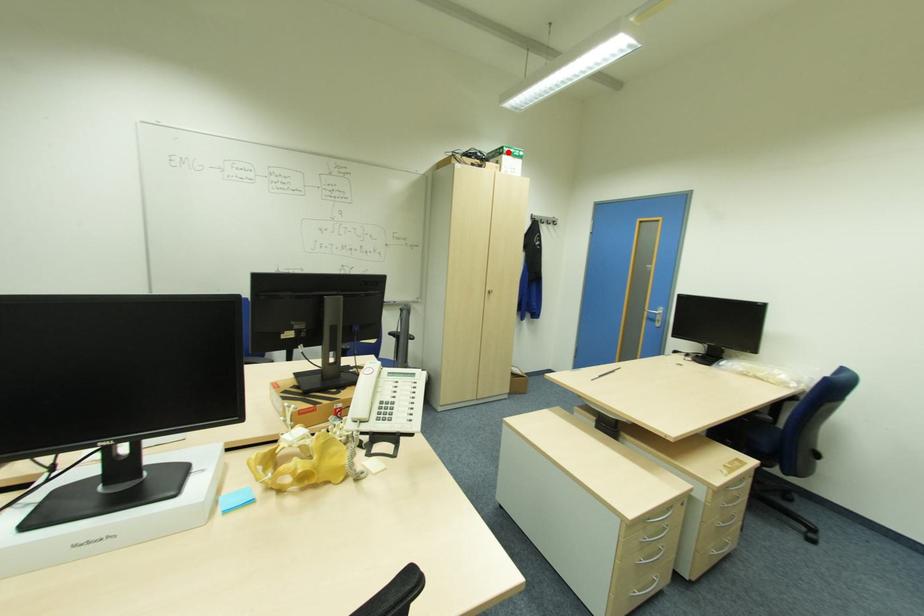
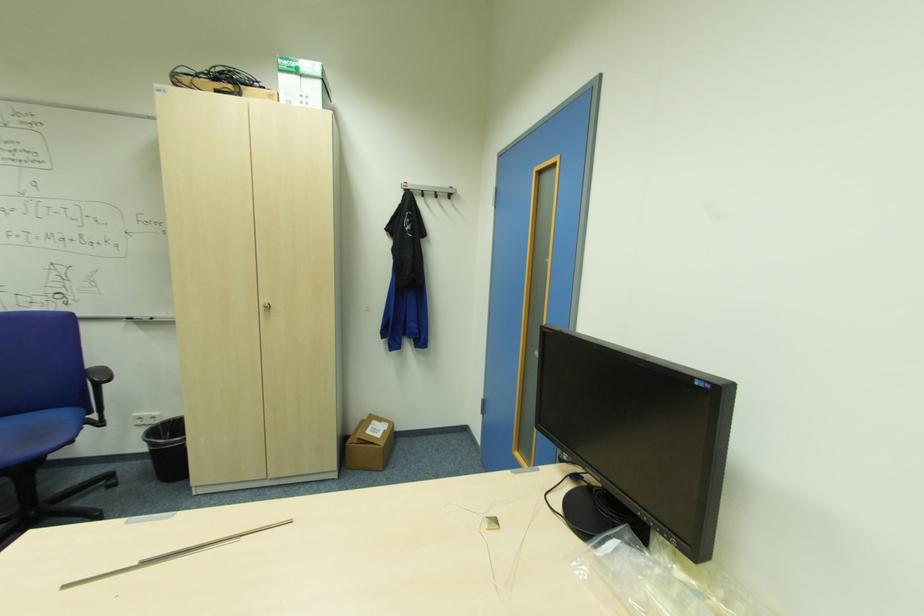
Locate, in the second image, the point that corresponds to the highlighted location in the first image.

(287, 69)